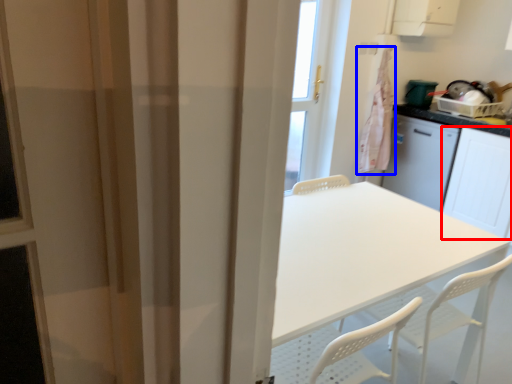
Question: Which object is closer to the camera taking this photo, screen door (highlighted by a red box) or laundry (highlighted by a blue box)?

Choices:
 (A) screen door
 (B) laundry

Answer: (A)